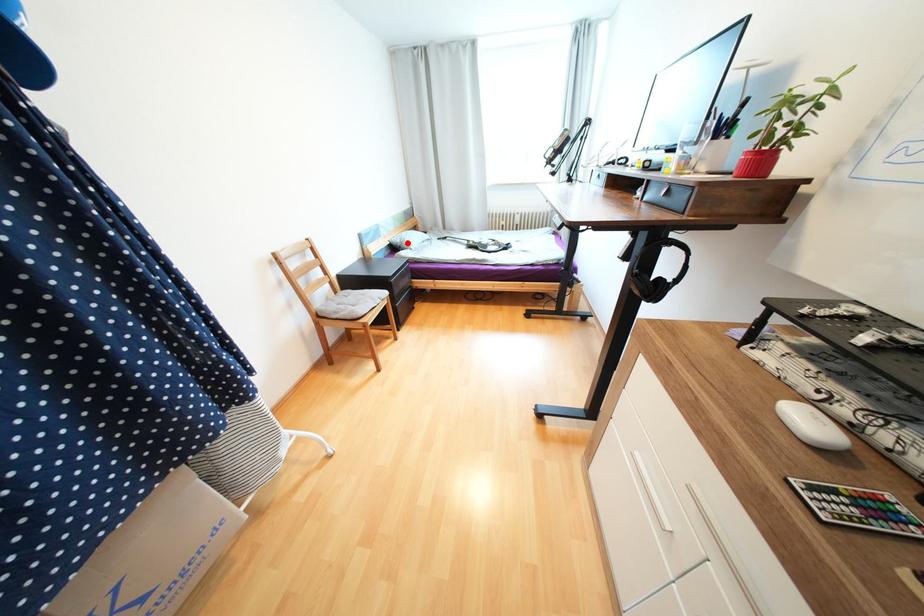
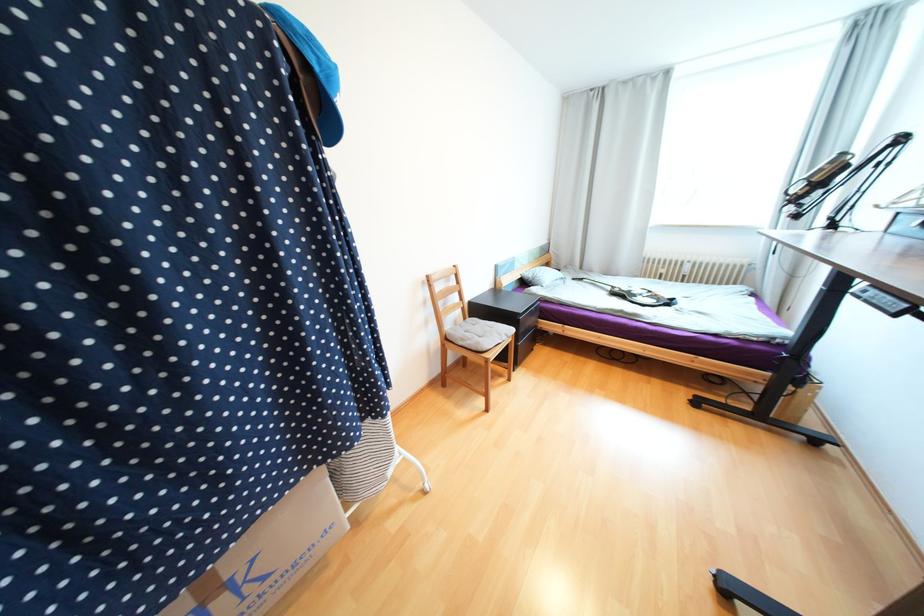
The point at the highlighted location is marked in the first image. Where is the corresponding point in the second image?

(540, 278)